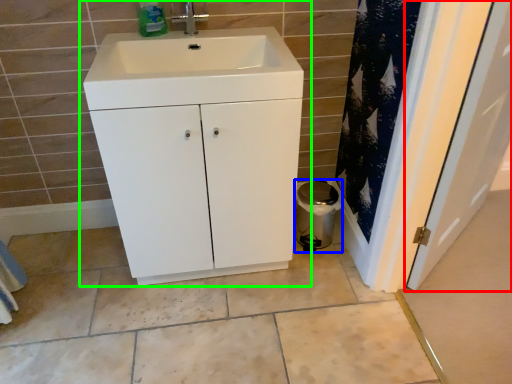
Question: Which object is positioned closest to door (highlighted by a red box)? Select from appliance (highlighted by a blue box) and bathroom cabinet (highlighted by a green box).

Choices:
 (A) appliance
 (B) bathroom cabinet

Answer: (A)